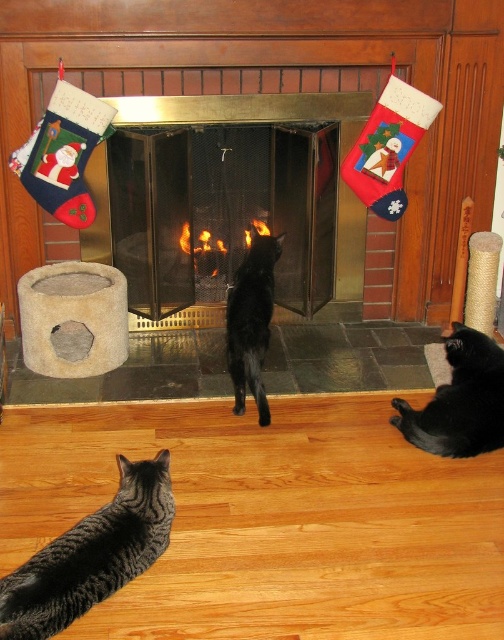
Question: Does tabby fur cat at lower left appear on the left side of black glossy cat at center?

Choices:
 (A) yes
 (B) no

Answer: (A)

Question: Which point is closer to the camera?

Choices:
 (A) (263, 392)
 (B) (457, 417)

Answer: (B)

Question: Which object appears farthest from the camera in this image?

Choices:
 (A) tabby fur cat at lower left
 (B) metallic fireplace at center
 (C) black glossy cat at center

Answer: (B)

Question: Does metallic fireplace at center appear on the left side of black glossy cat at center?

Choices:
 (A) yes
 (B) no

Answer: (A)

Question: Does black fur cat at lower right appear on the right side of black glossy cat at center?

Choices:
 (A) yes
 (B) no

Answer: (A)

Question: Which point is closer to the camera taking this photo?

Choices:
 (A) (342, 248)
 (B) (166, 500)
 (C) (480, 412)
 (D) (248, 304)

Answer: (B)